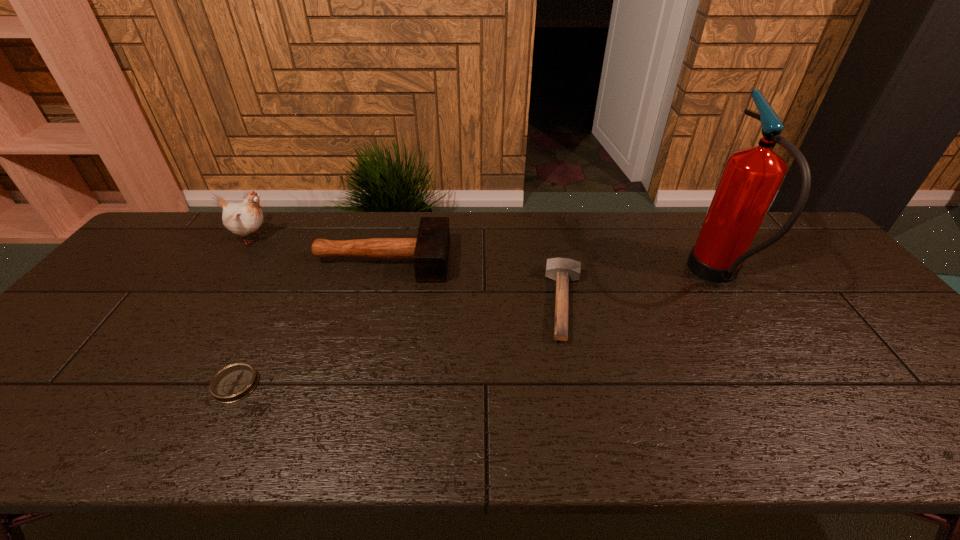
Where is `vacant area that satisfies the following two spatial constraints: 1. on the hammer head face of the third object from right to left; 2. on the right side of the second object from right to left`? This screenshot has width=960, height=540. vacant area that satisfies the following two spatial constraints: 1. on the hammer head face of the third object from right to left; 2. on the right side of the second object from right to left is located at coordinates (371, 303).